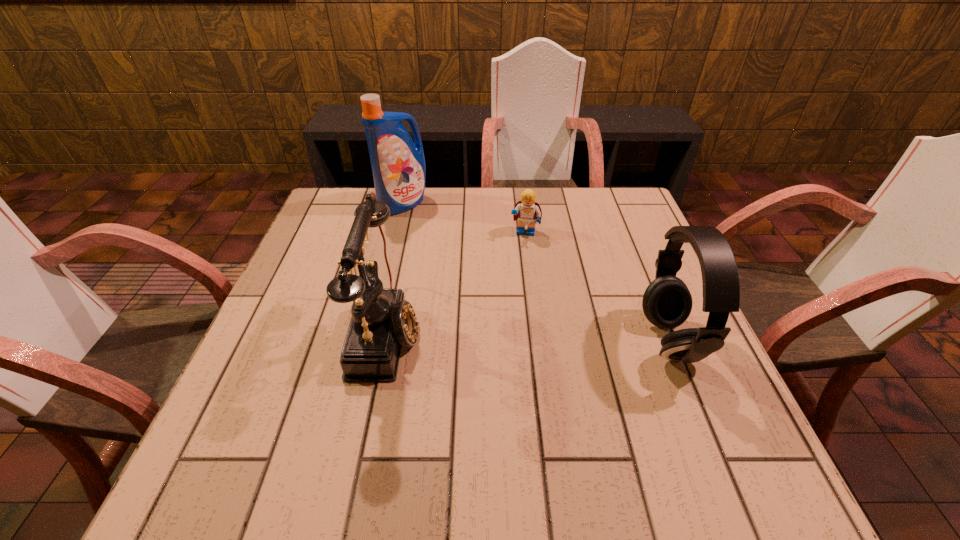
The image size is (960, 540). What are the coordinates of `object present at the far left corner` in the screenshot? It's located at (398, 165).

The width and height of the screenshot is (960, 540). What are the coordinates of `vacant area at the far edge of the desktop` in the screenshot? It's located at (499, 215).

Locate an element on the screen. free region at the near edge of the desktop is located at coordinates (385, 426).

This screenshot has width=960, height=540. In the image, there is a desktop. Identify the location of vacant space at the left edge. (298, 326).

Where is `free space at the right edge`? free space at the right edge is located at coordinates (640, 271).

The height and width of the screenshot is (540, 960). In the image, there is a desktop. What are the coordinates of `free space at the far left corner` in the screenshot? It's located at (352, 217).

I want to click on vacant space at the far right corner, so [629, 230].

In the image, there is a desktop. Where is `free space at the near right corner`? free space at the near right corner is located at coordinates (703, 437).

Find the location of a particular element. The width and height of the screenshot is (960, 540). free space between the second farthest object and the earphone is located at coordinates (597, 287).

Identify the location of vacant area that lies between the rightmost object and the Lego. Image resolution: width=960 pixels, height=540 pixels. (597, 287).